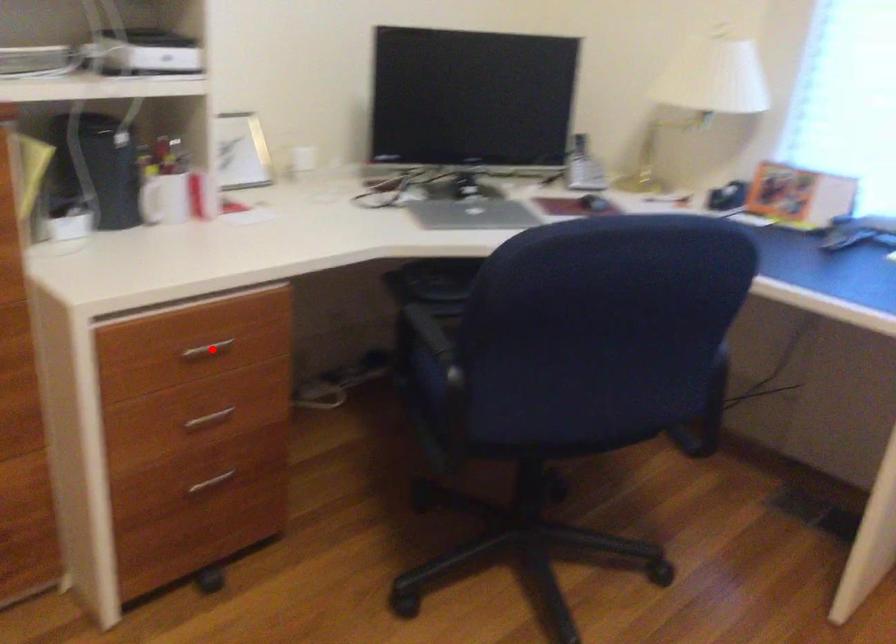
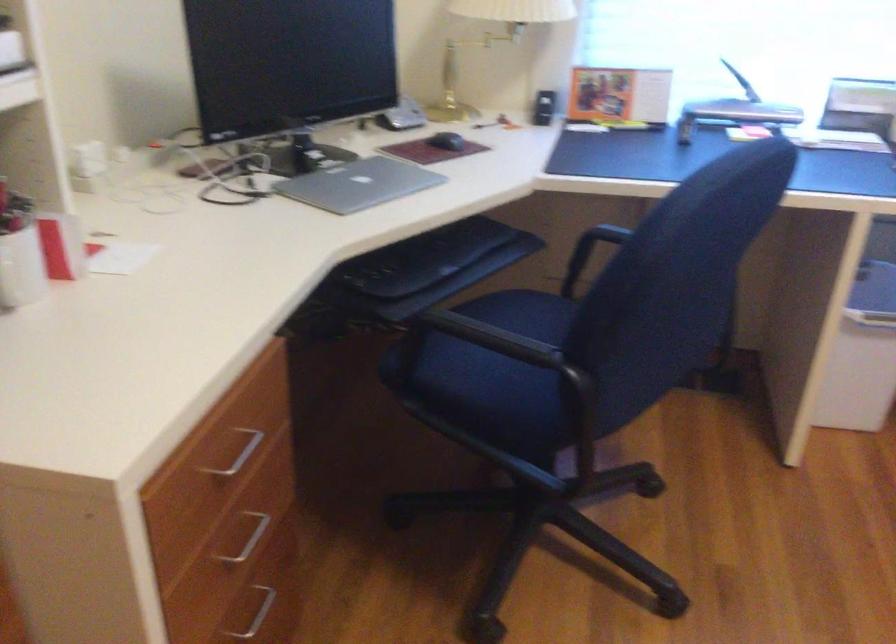
Locate, in the second image, the point that corresponds to the highlighted location in the first image.

(238, 453)